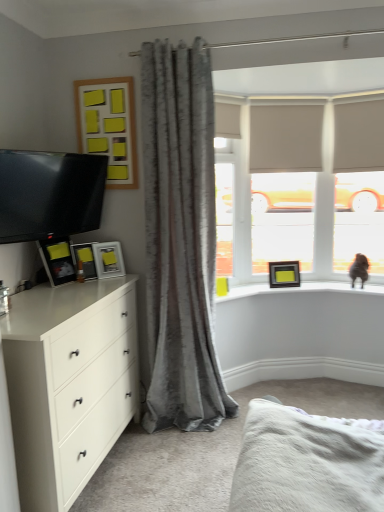
Describe the element at coordinates (307, 462) in the screenshot. I see `fuzzy white bed at lower right` at that location.

Where is `matte black tv at left`? matte black tv at left is located at coordinates (49, 194).

This screenshot has height=512, width=384. Describe the element at coordinates (68, 383) in the screenshot. I see `white glossy chest of drawers at left` at that location.

Where is `fuzzy white bed at lower right`? This screenshot has height=512, width=384. fuzzy white bed at lower right is located at coordinates (307, 462).

Between matte yellow picture frame at upper left, the 2th picture frame viewed from the right, and satin gray curtain at center, which one has larger size?

With larger size is satin gray curtain at center.

Does matte yellow picture frame at upper left, which is the third picture frame in top-to-bottom order, touch satin gray curtain at center?

matte yellow picture frame at upper left, which is the third picture frame in top-to-bottom order, and satin gray curtain at center are clearly separated.

Is matte yellow picture frame at upper left, the 3th picture frame ordered from the bottom, positioned with its back to satin gray curtain at center?

No, satin gray curtain at center is not at the back of matte yellow picture frame at upper left, the 3th picture frame ordered from the bottom.

In the scene shown: Would you say beige fabric blind at upper center contains brown furry cat at upper right?

No.

Consider the image. From the image's perspective, is beige fabric blind at upper center on top of brown furry cat at upper right?

Indeed, from the image's perspective, beige fabric blind at upper center is shown above brown furry cat at upper right.

Does beige fabric blind at upper center have a lesser height compared to brown furry cat at upper right?

No.

Consider the image. Which object is wider, beige fabric blind at upper center or brown furry cat at upper right?

With larger width is brown furry cat at upper right.

Is transparent glass door at upper right oriented away from wooden frame with yellow sticky notes at upper left, arranged as the 3th picture frame when viewed from the left?

No, transparent glass door at upper right is not facing away from wooden frame with yellow sticky notes at upper left, arranged as the 3th picture frame when viewed from the left.

From the image's perspective, would you say transparent glass door at upper right is positioned over wooden frame with yellow sticky notes at upper left, marked as the 2th picture frame in a front-to-back arrangement?

Incorrect, from the image's perspective, transparent glass door at upper right is lower than wooden frame with yellow sticky notes at upper left, marked as the 2th picture frame in a front-to-back arrangement.

Between transparent glass door at upper right and wooden frame with yellow sticky notes at upper left, marked as the 2th picture frame in a front-to-back arrangement, which one has larger width?

Wider between the two is transparent glass door at upper right.

Considering the sizes of objects transparent glass door at upper right and wooden frame with yellow sticky notes at upper left, acting as the fifth picture frame starting from the bottom, in the image provided, who is taller, transparent glass door at upper right or wooden frame with yellow sticky notes at upper left, acting as the fifth picture frame starting from the bottom,?

transparent glass door at upper right is taller.

From a real-world perspective, is white glossy chest of drawers at left under matte black picture frame at left, the 1th picture frame from the front?

Yes, from a real-world perspective, white glossy chest of drawers at left is under matte black picture frame at left, the 1th picture frame from the front.

Who is shorter, white glossy chest of drawers at left or matte black picture frame at left, the 1th picture frame from the front?

Standing shorter between the two is matte black picture frame at left, the 1th picture frame from the front.

From the image's perspective, who appears lower, white glossy chest of drawers at left or matte black picture frame at left, the 1th picture frame from the front?

white glossy chest of drawers at left is shown below in the image.

Are transparent glass door at upper right and satin gray curtain at center beside each other?

They are not placed beside each other.

Considering the relative sizes of transparent glass door at upper right and satin gray curtain at center in the image provided, is transparent glass door at upper right wider than satin gray curtain at center?

No.

Measure the distance between transparent glass door at upper right and satin gray curtain at center.

transparent glass door at upper right and satin gray curtain at center are 4.38 feet apart.

Is transparent glass door at upper right at the right side of satin gray curtain at center?

Yes.

Is matte black tv at left not within beige fabric window frame at upper center?

matte black tv at left is positioned outside beige fabric window frame at upper center.

In terms of width, does matte black tv at left look wider or thinner when compared to beige fabric window frame at upper center?

In the image, matte black tv at left appears to be wider than beige fabric window frame at upper center.

From the image's perspective, relative to beige fabric window frame at upper center, is matte black tv at left above or below?

matte black tv at left is situated lower than beige fabric window frame at upper center in the image.

How far apart are beige fabric blind at upper center and matte black picture frame at left, which ranks as the 2th picture frame in bottom-to-top order?

beige fabric blind at upper center and matte black picture frame at left, which ranks as the 2th picture frame in bottom-to-top order, are 1.54 meters apart from each other.

Considering the sizes of beige fabric blind at upper center and matte black picture frame at left, which is the 4th picture frame from top to bottom, in the image, is beige fabric blind at upper center taller or shorter than matte black picture frame at left, which is the 4th picture frame from top to bottom,?

Clearly, beige fabric blind at upper center is taller compared to matte black picture frame at left, which is the 4th picture frame from top to bottom.

Between point (285, 118) and point (89, 272), which one is positioned in front?

The point (89, 272) is in front.

Starting from the satin gray curtain at center, which picture frame is the 1st one to the left? Please provide its 2D coordinates.

[(108, 259)]

At what (x,y) coordinates should I click in order to perform the action: click on cat below the beige fabric blind at upper center (from the image's perspective). Please return your answer as a coordinate pair (x, y). This screenshot has width=384, height=512. Looking at the image, I should click on (359, 269).

From the picture: Considering their positions, is fuzzy white bed at lower right positioned further to transparent glass door at upper right than brown furry cat at upper right?

The object further to transparent glass door at upper right is fuzzy white bed at lower right.

Estimate the real-world distances between objects in this image. Which object is closer to transparent glass door at upper right, wooden frame with yellow sticky notes at upper left, acting as the fifth picture frame starting from the bottom, or beige fabric window frame at upper center?

beige fabric window frame at upper center.

Looking at this image, from the image, which object appears to be nearer to satin gray curtain at center, matte black picture frame at upper right, which is the first picture frame in right-to-left order, or brown furry cat at upper right?

matte black picture frame at upper right, which is the first picture frame in right-to-left order, lies closer to satin gray curtain at center than the other object.

When comparing their distances from beige fabric window frame at upper center, does beige fabric blind at upper center or matte black picture frame at upper right, which ranks as the 5th picture frame in left-to-right order, seem closer?

beige fabric blind at upper center is closer to beige fabric window frame at upper center.

Consider the image. From the image, which object appears to be nearer to wooden frame with yellow sticky notes at upper left, arranged as the 3th picture frame when viewed from the left, matte black picture frame at left, which appears as the 2th picture frame when viewed from the top, or matte yellow picture frame at upper left, which ranks as the 4th picture frame in front-to-back order?

matte yellow picture frame at upper left, which ranks as the 4th picture frame in front-to-back order.

Based on their spatial positions, is transparent glass door at upper right or wooden frame with yellow sticky notes at upper left, acting as the fifth picture frame starting from the bottom, further from fuzzy white bed at lower right?

The object further to fuzzy white bed at lower right is transparent glass door at upper right.

From the image, which object appears to be farther from matte black picture frame at left, positioned as the fifth picture frame in right-to-left order, white glossy chest of drawers at left or beige fabric window frame at upper center?

Based on the image, beige fabric window frame at upper center appears to be further to matte black picture frame at left, positioned as the fifth picture frame in right-to-left order.

Estimate the real-world distances between objects in this image. Which object is closer to fuzzy white bed at lower right, satin gray curtain at center or wooden frame with yellow sticky notes at upper left, arranged as the 3th picture frame when viewed from the left?

satin gray curtain at center is positioned closer to the anchor fuzzy white bed at lower right.

This screenshot has width=384, height=512. Find the location of `blind between matte black picture frame at left, positioned as the fifth picture frame in right-to-left order, and matte black picture frame at upper right, which is the fifth picture frame from front to back`. blind between matte black picture frame at left, positioned as the fifth picture frame in right-to-left order, and matte black picture frame at upper right, which is the fifth picture frame from front to back is located at coordinates (285, 138).

You are a GUI agent. You are given a task and a screenshot of the screen. Output one action in this format:
    pyautogui.click(x=<x>, y=<y>)
    Task: Click on the window frame between matte yellow picture frame at upper left, which is the third picture frame in top-to-bottom order, and matte black picture frame at upper right, which is the first picture frame in right-to-left order, in the horizontal direction
    The height and width of the screenshot is (512, 384).
    Given the screenshot: What is the action you would take?
    pyautogui.click(x=282, y=185)

Where is `picture frame between wooden frame with yellow sticky notes at upper left, acting as the fifth picture frame starting from the bottom, and matte yellow picture frame at upper left, the fourth picture frame when ordered from left to right, in the vertical direction`? Image resolution: width=384 pixels, height=512 pixels. picture frame between wooden frame with yellow sticky notes at upper left, acting as the fifth picture frame starting from the bottom, and matte yellow picture frame at upper left, the fourth picture frame when ordered from left to right, in the vertical direction is located at coordinates [x=57, y=260].

The height and width of the screenshot is (512, 384). What are the coordinates of `window frame between wooden frame with yellow sticky notes at upper left, the 1th picture frame viewed from the top, and beige fabric blind at upper center from left to right` in the screenshot? It's located at (282, 185).